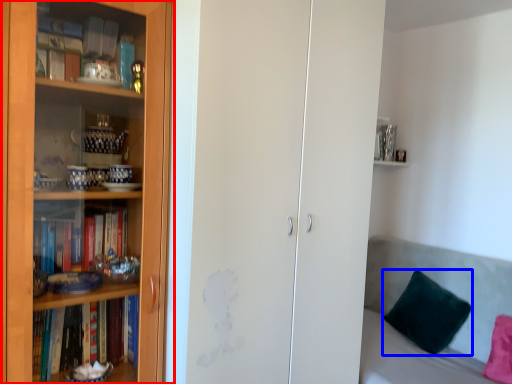
Question: Which point is closer to the camera, bookcase (highlighted by a red box) or pillow (highlighted by a blue box)?

Choices:
 (A) bookcase
 (B) pillow

Answer: (A)